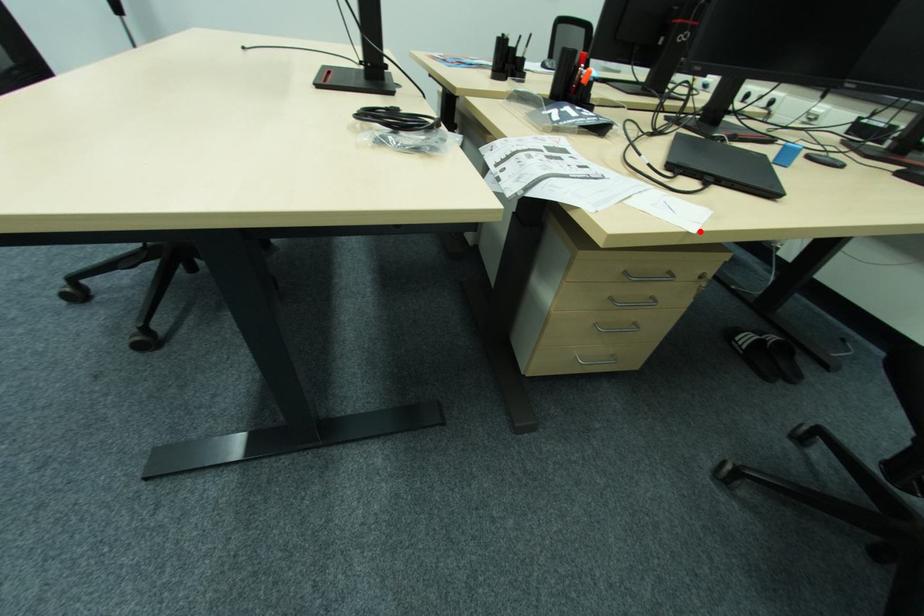
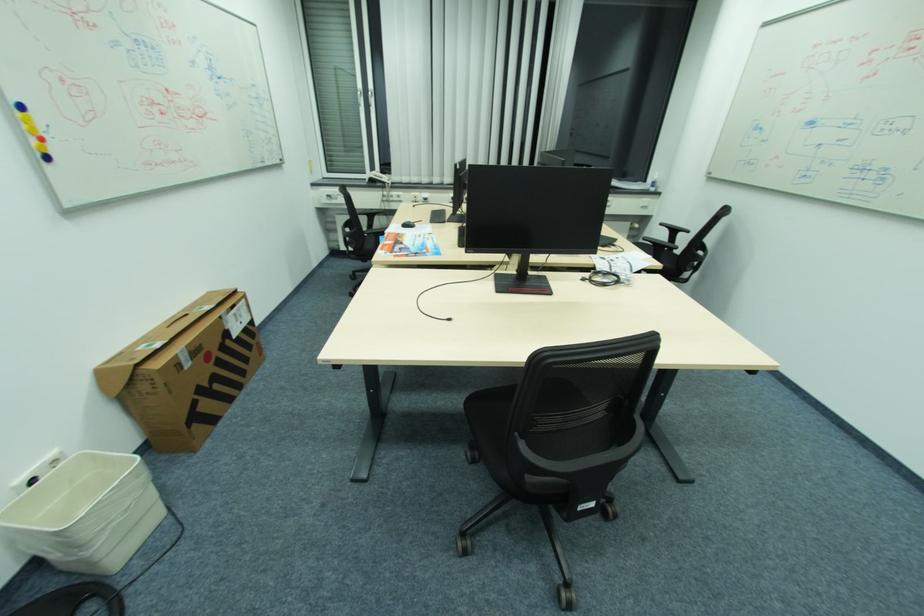
In the second image, find the point that corresponds to the highlighted location in the first image.

(657, 257)